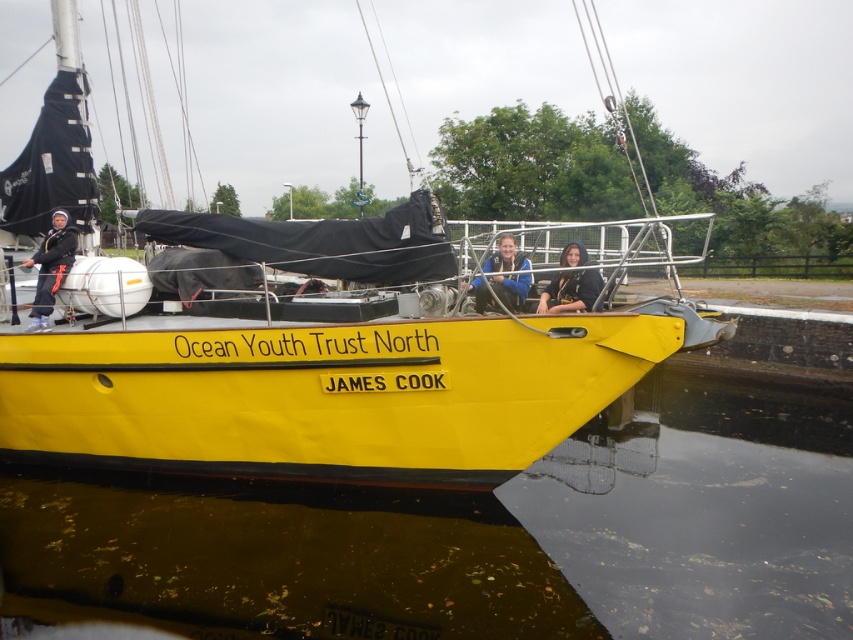
The image size is (853, 640). Describe the element at coordinates (570, 291) in the screenshot. I see `black matte jacket at center` at that location.

Can you confirm if black matte jacket at center is positioned to the left of blue fabric jacket at center?

No, black matte jacket at center is not to the left of blue fabric jacket at center.

The height and width of the screenshot is (640, 853). What do you see at coordinates (570, 291) in the screenshot?
I see `black matte jacket at center` at bounding box center [570, 291].

Identify the location of black matte jacket at center. This screenshot has width=853, height=640. (570, 291).

Who is more forward, (42, 298) or (500, 260)?

Point (500, 260) is in front.

Between matte black jacket at left and blue fabric jacket at center, which one appears on the left side from the viewer's perspective?

matte black jacket at left is more to the left.

Measure the distance between point (55,269) and camera.

Point (55,269) and camera are 7.07 meters apart.

Find the location of a particular element. This screenshot has height=640, width=853. matte black jacket at left is located at coordinates (51, 268).

Looking at this image, between matte black jacket at left and black matte jacket at center, which one is positioned lower?

black matte jacket at center is lower down.

Does matte black jacket at left have a greater width compared to black matte jacket at center?

Yes, matte black jacket at left is wider than black matte jacket at center.

Locate an element on the screen. matte black jacket at left is located at coordinates (51, 268).